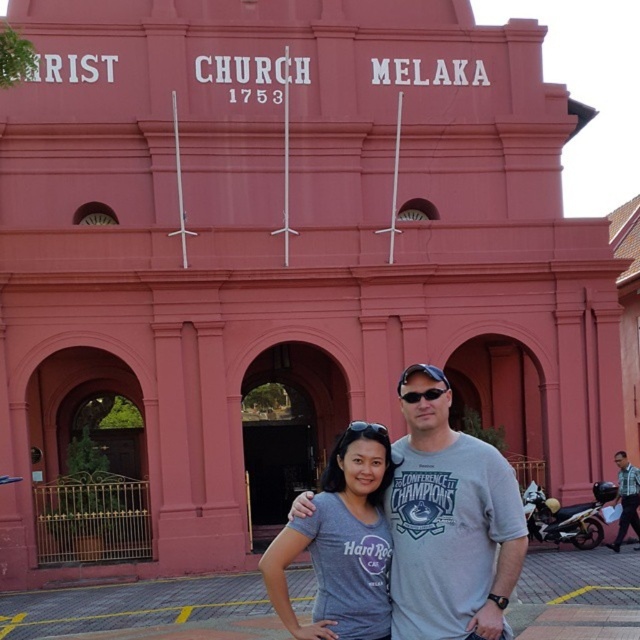
Question: Which point appears closest to the camera in this image?

Choices:
 (A) (618, 497)
 (B) (515, 502)
 (C) (278, 612)

Answer: (C)

Question: Does gray t-shirt at center appear on the right side of matte gray t-shirt at center?

Choices:
 (A) yes
 (B) no

Answer: (A)

Question: Among these points, which one is farthest from the camera?

Choices:
 (A) (401, 374)
 (B) (388, 547)

Answer: (A)

Question: Can you confirm if gray t-shirt at center is positioned below striped shirt at center?

Choices:
 (A) no
 (B) yes

Answer: (A)

Question: Which of the following is the closest to the observer?

Choices:
 (A) gray t-shirt at center
 (B) striped shirt at center

Answer: (A)

Question: Is gray t-shirt at center smaller than matte gray t-shirt at center?

Choices:
 (A) yes
 (B) no

Answer: (B)